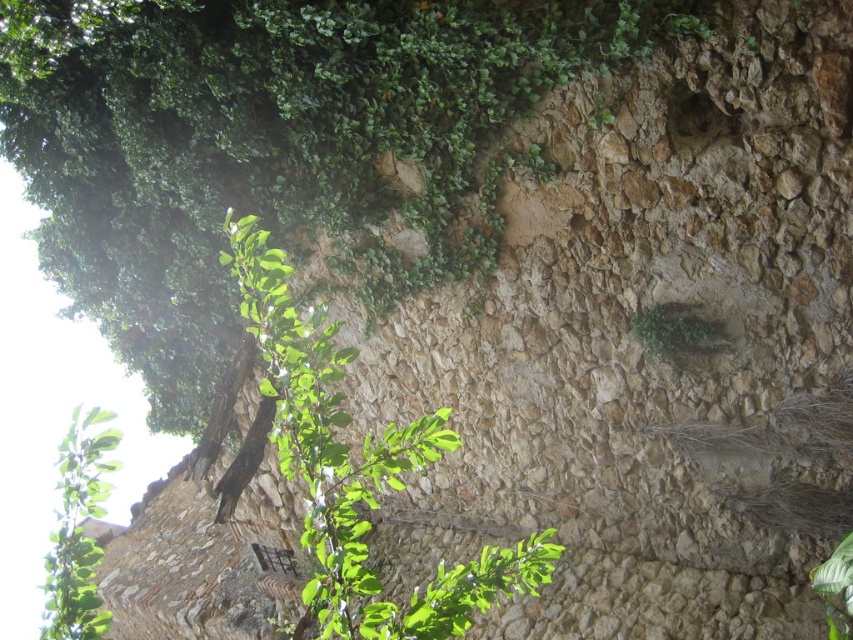
You are standing in front of the stone wall and want to touch the green leafy branch at upper left. Based on its 2D coordinates, where should you look to find it?

The green leafy branch at upper left is located at the 2D coordinates point (78, 531), so you should look towards the upper left area of the wall to find it.

You are an archaeologist examining the stone wall. You notice the green leafy branch at upper left and the green leafy plant at center. Which one appears nearer to you?

The green leafy branch at upper left is closer to the viewer than the green leafy plant at center.

You are a gardener standing at the base of the stone wall. You need to reach both the green leafy branch at upper left and the green leafy plant at center to prune them. Given that your ladder can extend up to 2.5 meters, will you be able to reach both plants with the ladder?

The distance between the green leafy branch at upper left and the green leafy plant at center is 3.08 meters. Since your ladder extends only up to 2.5 meters, you won